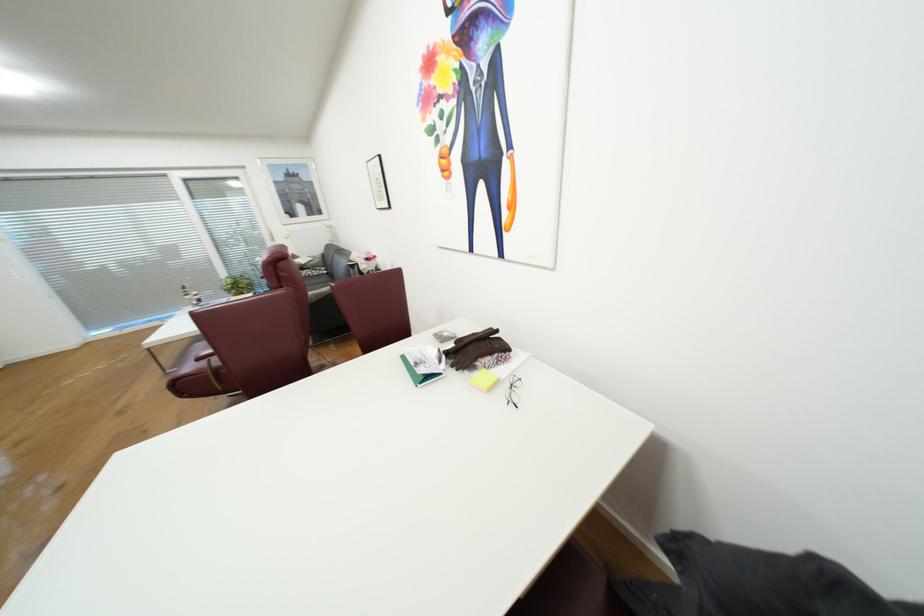
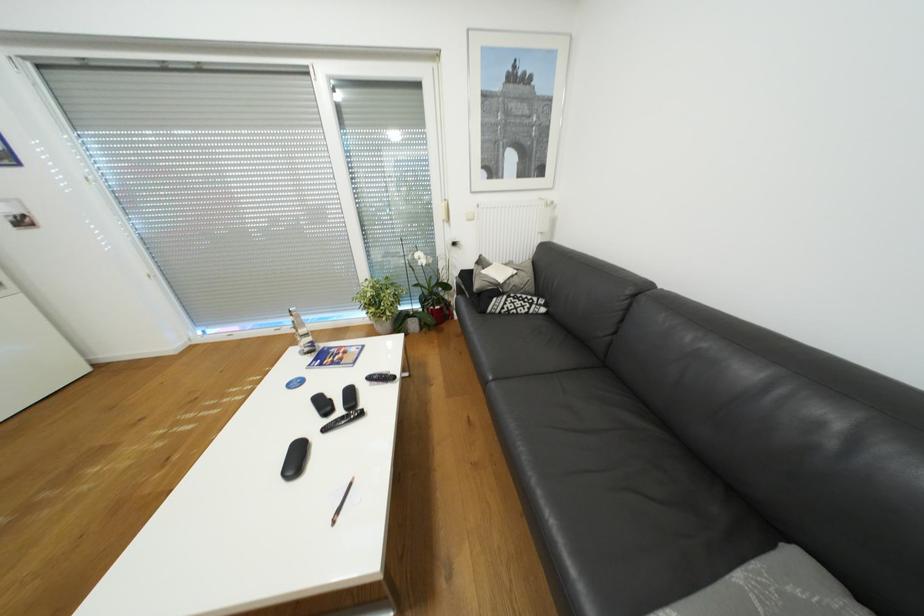
In a continuous first-person perspective shot, in which direction is the camera moving?

The movement direction of the cameraman is left, forward.